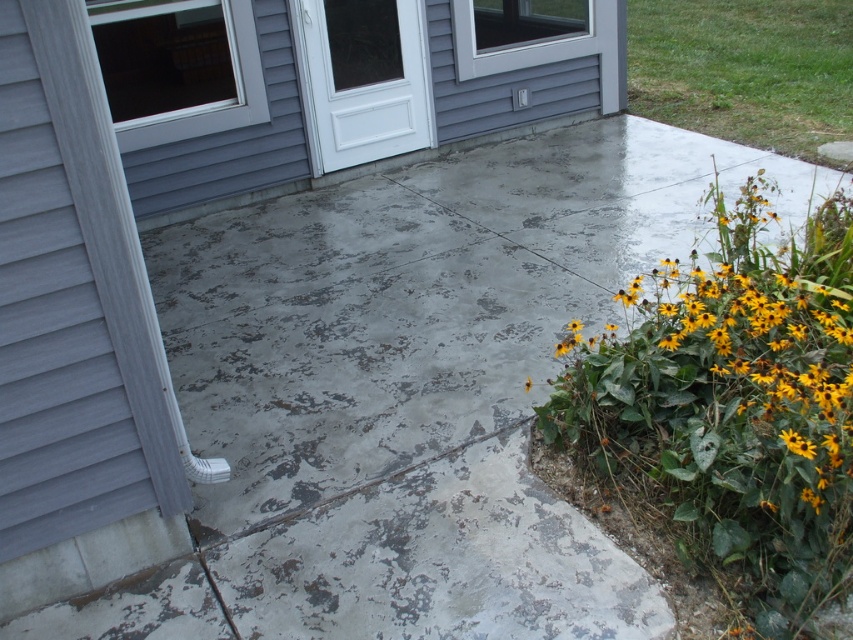
How far apart are yellow matte flower at lower right and gray concrete terrace at upper center?

yellow matte flower at lower right is 3.14 meters away from gray concrete terrace at upper center.

The height and width of the screenshot is (640, 853). Describe the element at coordinates (724, 381) in the screenshot. I see `yellow matte flower at lower right` at that location.

You are a GUI agent. You are given a task and a screenshot of the screen. Output one action in this format:
    pyautogui.click(x=<x>, y=<y>)
    Task: Click on the yellow matte flower at lower right
    Image resolution: width=853 pixels, height=640 pixels.
    Given the screenshot: What is the action you would take?
    pyautogui.click(x=724, y=381)

Can you confirm if gray concrete terrace at upper center is positioned above white glossy door at center?

Yes.

Between gray concrete terrace at upper center and white glossy door at center, which one has less height?

With less height is white glossy door at center.

Who is more forward, (497, 74) or (350, 3)?

Point (350, 3) is more forward.

Image resolution: width=853 pixels, height=640 pixels. I want to click on gray concrete terrace at upper center, so click(346, 84).

Is yellow matte flower at lower right above white glossy door at center?

No, yellow matte flower at lower right is not above white glossy door at center.

Can you confirm if yellow matte flower at lower right is positioned to the left of white glossy door at center?

In fact, yellow matte flower at lower right is to the right of white glossy door at center.

Between point (735, 502) and point (383, 61), which one is positioned behind?

Positioned behind is point (383, 61).

This screenshot has width=853, height=640. Find the location of `yellow matte flower at lower right`. yellow matte flower at lower right is located at coordinates pyautogui.click(x=724, y=381).